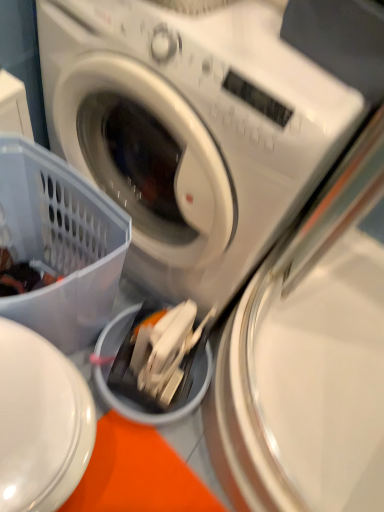
Question: From a real-world perspective, is white plastic washing machine at center, the first washing machine when ordered from top to bottom, positioned above or below translucent plastic basket at lower left?

Choices:
 (A) above
 (B) below

Answer: (A)

Question: Is white plastic washing machine at center, positioned as the 2th washing machine in bottom-to-top order, inside or outside of translucent plastic basket at lower left?

Choices:
 (A) outside
 (B) inside

Answer: (A)

Question: Which object is positioned farthest from the metallic silver washing machine at center, which appears as the 1th washing machine when ordered from the bottom?

Choices:
 (A) white plastic washing machine at center, the first washing machine when ordered from top to bottom
 (B) translucent plastic basket at lower left

Answer: (B)

Question: Which is nearer to the translucent plastic basket at lower left?

Choices:
 (A) white plastic washing machine at center, the first washing machine when ordered from top to bottom
 (B) metallic silver washing machine at center, positioned as the 2th washing machine in top-to-bottom order

Answer: (A)